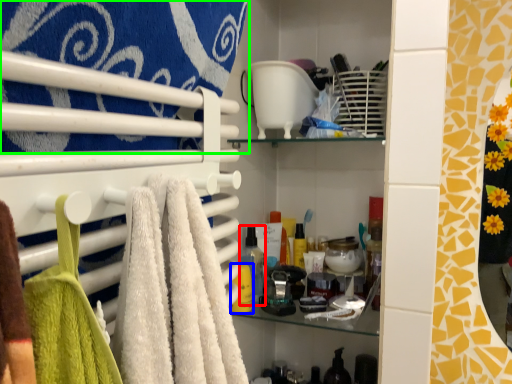
Question: Which is nearer to the toiletry (highlighted by a red box)? toiletry (highlighted by a blue box) or towel (highlighted by a green box).

Choices:
 (A) toiletry
 (B) towel

Answer: (A)